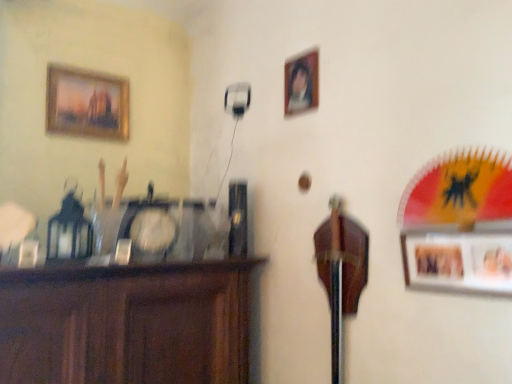
Question: Is brown wood cabinet at left next to gold-framed painting at upper left, the third picture frame from the front, and touching it?

Choices:
 (A) no
 (B) yes

Answer: (A)

Question: Is gold-framed painting at upper left, which appears as the second picture frame when viewed from the top, surrounded by brown wood cabinet at left?

Choices:
 (A) yes
 (B) no

Answer: (B)

Question: Is brown wood cabinet at left thinner than gold-framed painting at upper left, marked as the 2th picture frame in a bottom-to-top arrangement?

Choices:
 (A) yes
 (B) no

Answer: (B)

Question: Considering the relative sizes of brown wood cabinet at left and gold-framed painting at upper left, marked as the 2th picture frame in a bottom-to-top arrangement, in the image provided, is brown wood cabinet at left smaller than gold-framed painting at upper left, marked as the 2th picture frame in a bottom-to-top arrangement,?

Choices:
 (A) yes
 (B) no

Answer: (B)

Question: From the image's perspective, is brown wood cabinet at left under gold-framed painting at upper left, marked as the 2th picture frame in a bottom-to-top arrangement?

Choices:
 (A) yes
 (B) no

Answer: (A)

Question: Is wooden photo frame at right, the 1th picture frame in the right-to-left sequence, taller or shorter than wooden portrait frame at upper center, marked as the 1th picture frame in a top-to-bottom arrangement?

Choices:
 (A) tall
 (B) short

Answer: (B)

Question: Do you think wooden photo frame at right, acting as the third picture frame starting from the left, is within wooden portrait frame at upper center, which is the 2th picture frame in front-to-back order, or outside of it?

Choices:
 (A) inside
 (B) outside

Answer: (B)

Question: Looking at their shapes, would you say wooden photo frame at right, the first picture frame when ordered from bottom to top, is wider or thinner than wooden portrait frame at upper center, the second picture frame in the back-to-front sequence?

Choices:
 (A) thin
 (B) wide

Answer: (B)

Question: Considering the positions of point (428, 236) and point (287, 86), is point (428, 236) closer or farther from the camera than point (287, 86)?

Choices:
 (A) farther
 (B) closer

Answer: (B)

Question: Looking at their shapes, would you say wooden portrait frame at upper center, which is the third picture frame from bottom to top, is wider or thinner than wooden photo frame at right, acting as the third picture frame starting from the left?

Choices:
 (A) thin
 (B) wide

Answer: (A)

Question: Is wooden portrait frame at upper center, the second picture frame in the back-to-front sequence, in front of or behind wooden photo frame at right, which is counted as the third picture frame, starting from the top, in the image?

Choices:
 (A) behind
 (B) front

Answer: (A)

Question: Based on their sizes in the image, would you say wooden portrait frame at upper center, marked as the 1th picture frame in a top-to-bottom arrangement, is bigger or smaller than wooden photo frame at right, acting as the third picture frame starting from the left?

Choices:
 (A) small
 (B) big

Answer: (A)

Question: Is wooden portrait frame at upper center, arranged as the second picture frame when viewed from the left, inside or outside of wooden photo frame at right, the 1th picture frame in the right-to-left sequence?

Choices:
 (A) inside
 (B) outside

Answer: (B)

Question: From the image's perspective, is wooden portrait frame at upper center, the second picture frame in the back-to-front sequence, positioned above or below brown wood cabinet at left?

Choices:
 (A) below
 (B) above

Answer: (B)

Question: Is wooden portrait frame at upper center, marked as the 1th picture frame in a top-to-bottom arrangement, taller or shorter than brown wood cabinet at left?

Choices:
 (A) short
 (B) tall

Answer: (A)